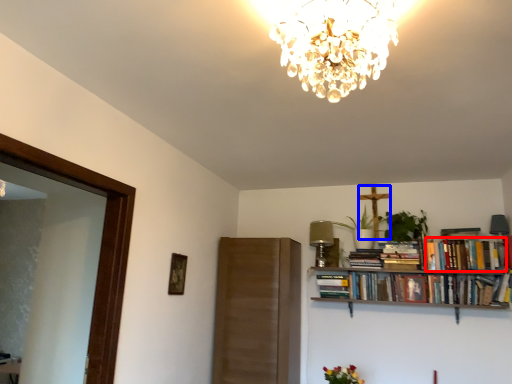
Question: Which object is closer to the camera taking this photo, book (highlighted by a red box) or crucifix (highlighted by a blue box)?

Choices:
 (A) book
 (B) crucifix

Answer: (A)